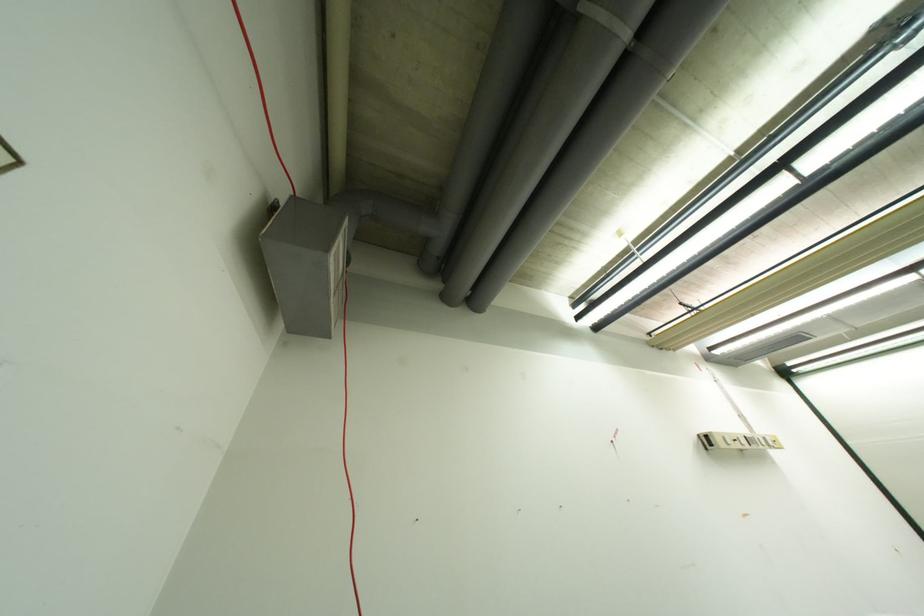
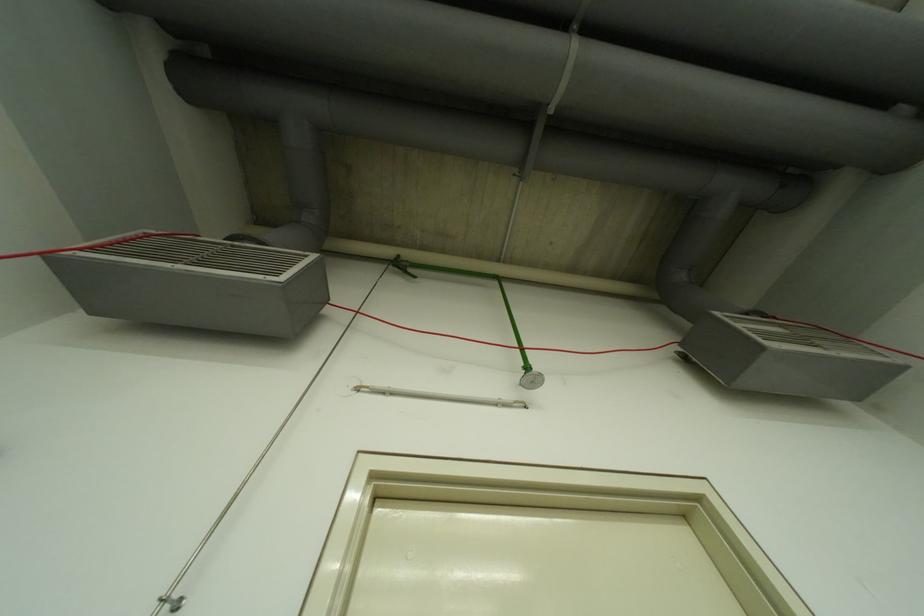
From the picture: Based on the continuous images, in which direction is the camera rotating?

The camera's rotation is toward left-up.